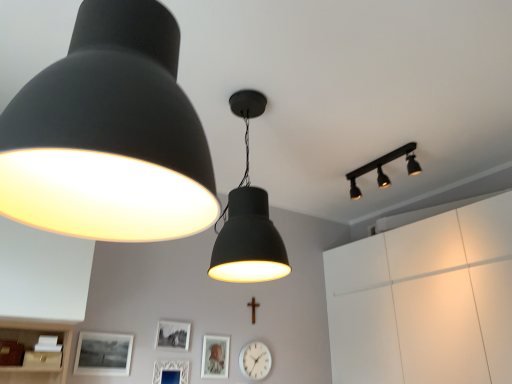
Question: Is point (413, 142) positioned closer to the camera than point (6, 170)?

Choices:
 (A) closer
 (B) farther

Answer: (B)

Question: From a real-world perspective, is matte black track light at upper right, positioned as the 3th lamp in left-to-right order, physically located above or below matte black lampshade at upper left, the first lamp positioned from the front?

Choices:
 (A) above
 (B) below

Answer: (A)

Question: Estimate the real-world distances between objects in this image. Which object is closer to the matte silver picture frame at center, which ranks as the 1th picture frame in right-to-left order?

Choices:
 (A) white plastic clock at center
 (B) wooden cross at center
 (C) matte black picture frame at lower center, which appears as the 2th picture frame when viewed from the left
 (D) matte black picture frame at lower left, marked as the first picture frame in a left-to-right arrangement
 (E) matte black track light at upper right, positioned as the 3th lamp in left-to-right order

Answer: (A)

Question: Which object is positioned closest to the matte black picture frame at lower left, positioned as the 4th picture frame in right-to-left order?

Choices:
 (A) wooden cross at center
 (B) white textured picture frame at lower center, which is the 2th picture frame from right to left
 (C) white plastic clock at center
 (D) matte black track light at upper right, which is the 1th lamp from right to left
 (E) matte black picture frame at lower center, arranged as the third picture frame when viewed from the right

Answer: (B)